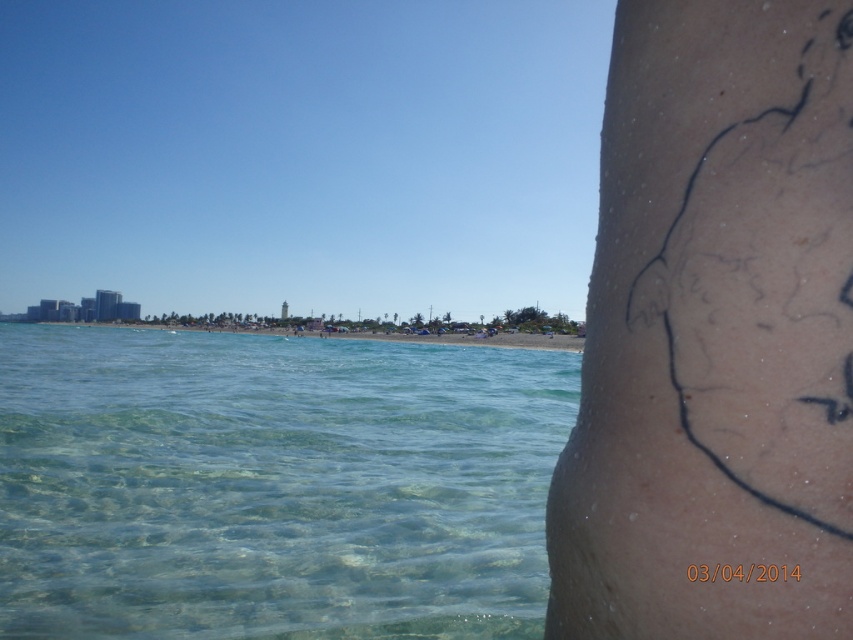
Who is higher up, smooth sand beach at center or black ink date at lower right?

Positioned higher is black ink date at lower right.

Based on the photo, is smooth sand beach at center smaller than black ink date at lower right?

No, smooth sand beach at center is not smaller than black ink date at lower right.

What do you see at coordinates (480, 339) in the screenshot?
I see `smooth sand beach at center` at bounding box center [480, 339].

Locate an element on the screen. The height and width of the screenshot is (640, 853). smooth sand beach at center is located at coordinates (480, 339).

Between point (740, 168) and point (424, 426), which one is positioned in front?

Point (740, 168) is in front.

Is black ink tattoo at right closer to camera compared to clear water at lower left?

That is True.

Who is more distant from viewer, (604, 477) or (459, 356)?

The point (459, 356) is behind.

Locate an element on the screen. black ink tattoo at right is located at coordinates (715, 332).

Which is in front, point (165, 396) or point (740, 563)?

Point (740, 563) is in front.

Is clear water at lower left taller than black ink date at lower right?

Correct, clear water at lower left is much taller as black ink date at lower right.

Is point (366, 525) more distant than point (764, 570)?

Yes, it is.

This screenshot has height=640, width=853. Identify the location of clear water at lower left. (273, 484).